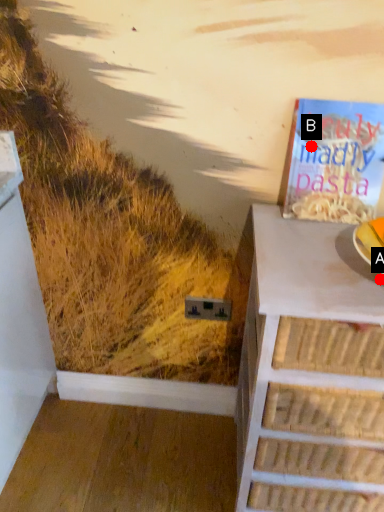
Question: Two points are circled on the image, labeled by A and B beside each circle. Among these points, which one is nearest to the camera?

Choices:
 (A) A is closer
 (B) B is closer

Answer: (A)